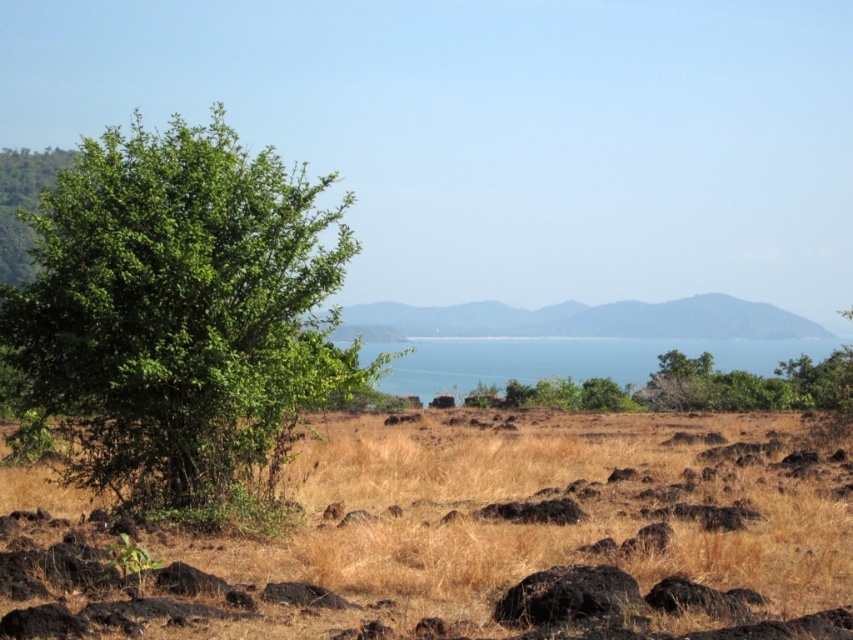
Between brown dry grass at center and green leafy tree at left, which one appears on the left side from the viewer's perspective?

From the viewer's perspective, green leafy tree at left appears more on the left side.

Which is in front, point (720, 436) or point (62, 276)?

Point (62, 276)

The image size is (853, 640). Identify the location of brown dry grass at center. (465, 540).